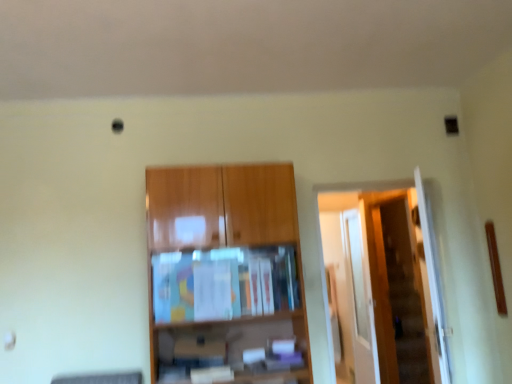
Question: From the image's perspective, is wooden cabinet at center beneath transparent glass door at right?

Choices:
 (A) no
 (B) yes

Answer: (A)

Question: Does wooden cabinet at center have a lesser width compared to transparent glass door at right?

Choices:
 (A) yes
 (B) no

Answer: (B)

Question: Can you confirm if wooden cabinet at center is positioned to the right of transparent glass door at right?

Choices:
 (A) no
 (B) yes

Answer: (A)

Question: From the image's perspective, is wooden cabinet at center over transparent glass door at right?

Choices:
 (A) yes
 (B) no

Answer: (A)

Question: Does wooden cabinet at center lie behind transparent glass door at right?

Choices:
 (A) yes
 (B) no

Answer: (B)

Question: Considering their positions, is wooden door at right located in front of or behind transparent glass door at right?

Choices:
 (A) front
 (B) behind

Answer: (A)

Question: From the image's perspective, is wooden door at right located above or below transparent glass door at right?

Choices:
 (A) below
 (B) above

Answer: (B)

Question: In terms of width, does wooden door at right look wider or thinner when compared to transparent glass door at right?

Choices:
 (A) wide
 (B) thin

Answer: (A)

Question: Choose the correct answer: Is wooden door at right inside transparent glass door at right or outside it?

Choices:
 (A) inside
 (B) outside

Answer: (B)

Question: Is transparent glass door at right in front of or behind wooden cabinet at center in the image?

Choices:
 (A) front
 (B) behind

Answer: (B)

Question: Do you think transparent glass door at right is within wooden cabinet at center, or outside of it?

Choices:
 (A) outside
 (B) inside

Answer: (A)

Question: From the image's perspective, is transparent glass door at right located above or below wooden cabinet at center?

Choices:
 (A) below
 (B) above

Answer: (A)

Question: Considering the positions of point (360, 286) and point (236, 175), is point (360, 286) closer or farther from the camera than point (236, 175)?

Choices:
 (A) farther
 (B) closer

Answer: (A)

Question: From a real-world perspective, is wooden cabinet at center positioned above or below transparent glass door at right?

Choices:
 (A) below
 (B) above

Answer: (B)

Question: From the image's perspective, is wooden cabinet at center positioned above or below transparent glass door at right?

Choices:
 (A) above
 (B) below

Answer: (A)